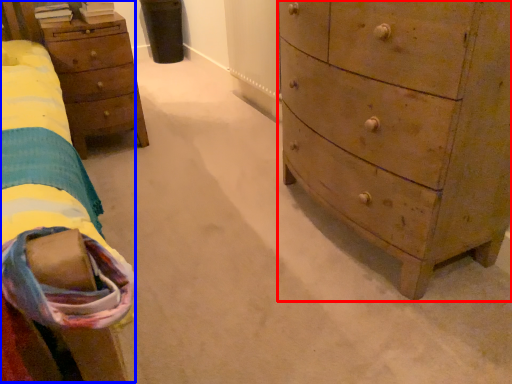
Question: Which object appears farthest to the camera in this image, chest of drawers (highlighted by a red box) or bed (highlighted by a blue box)?

Choices:
 (A) chest of drawers
 (B) bed

Answer: (A)